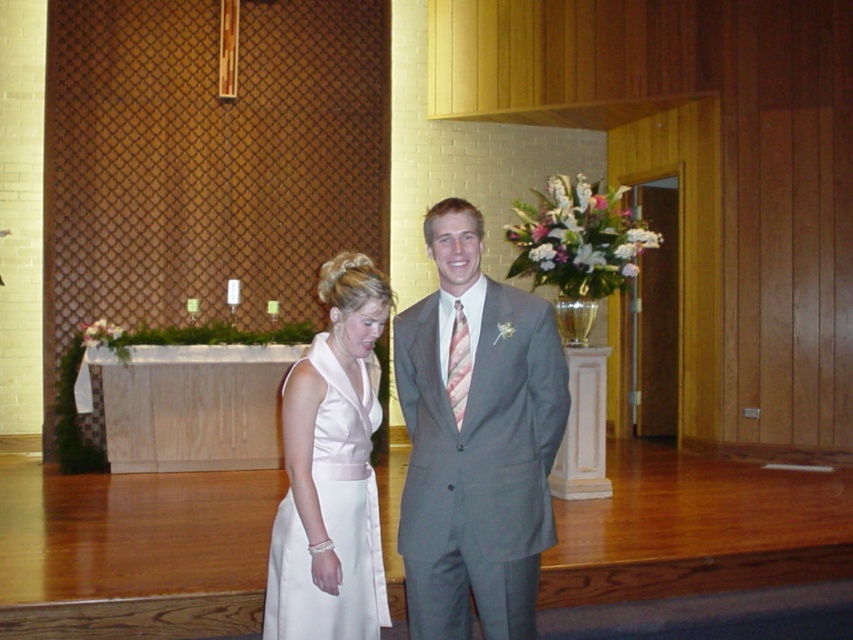
Is point (526, 454) positioned before point (456, 397)?

That is False.

Can you confirm if gray suit at center is taller than pink striped tie at center?

Indeed, gray suit at center has a greater height compared to pink striped tie at center.

Locate an element on the screen. The image size is (853, 640). gray suit at center is located at coordinates (476, 442).

Where is `gray suit at center`? gray suit at center is located at coordinates (476, 442).

This screenshot has height=640, width=853. What do you see at coordinates (332, 520) in the screenshot?
I see `white satin dress at center` at bounding box center [332, 520].

Can you confirm if white satin dress at center is positioned to the right of pink striped tie at center?

Incorrect, white satin dress at center is not on the right side of pink striped tie at center.

Where is `white satin dress at center`? The height and width of the screenshot is (640, 853). white satin dress at center is located at coordinates (332, 520).

Can you confirm if gray suit at center is positioned below white satin dress at center?

Actually, gray suit at center is above white satin dress at center.

Locate an element on the screen. gray suit at center is located at coordinates (476, 442).

What are the coordinates of `gray suit at center` in the screenshot? It's located at [476, 442].